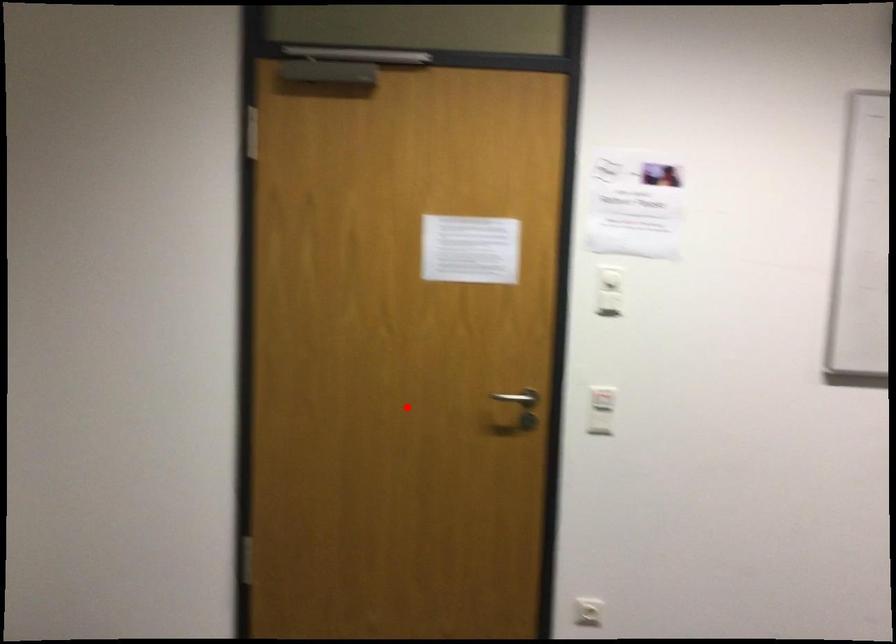
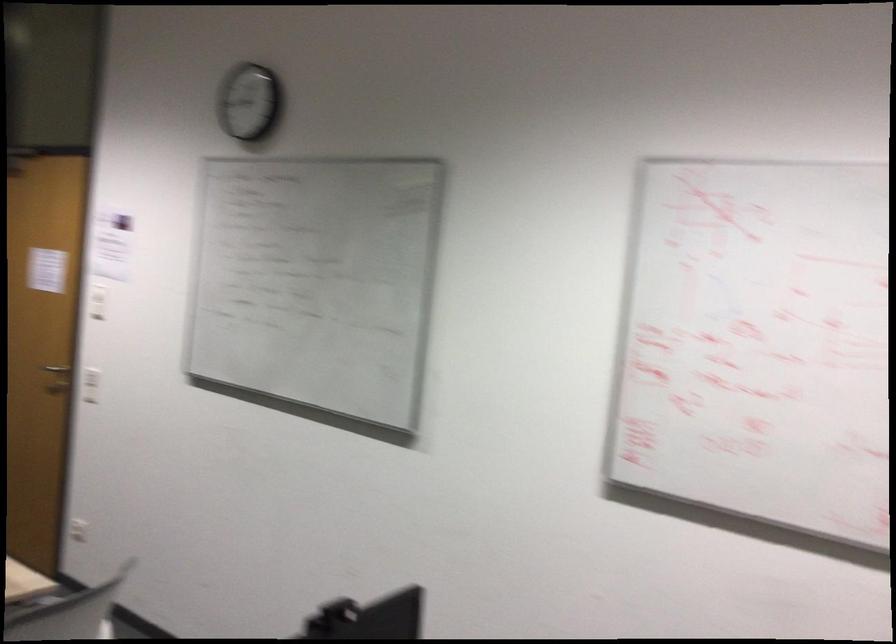
Where in the second image is the point corresponding to the highlighted location from the first image?

(56, 368)